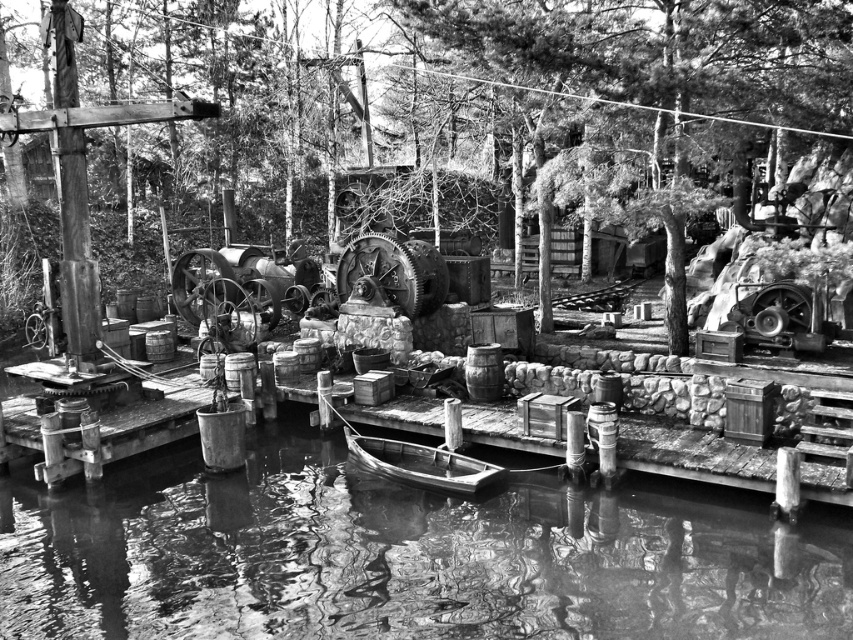
Consider the image. You are standing on the dock and want to move from point (28, 579) to point (480, 486). Which direction should you move to get closer to the water?

Point (28, 579) is closer to the viewer than point (480, 486), so to move towards the water, you should move away from the viewer, which would be towards point (480, 486).

You are a photographer standing at the edge of the dock and want to capture a wide shot of the scene. Which object, the smooth water at center or the wooden raft at center, will occupy more space in your photo?

The smooth water at center is larger in size than the wooden raft at center, so it will occupy more space in the photo.

Based on the scene described, where is the smooth water at center located in terms of its 2D coordinates?

The smooth water at center is located at the 2D coordinates point (402, 556).